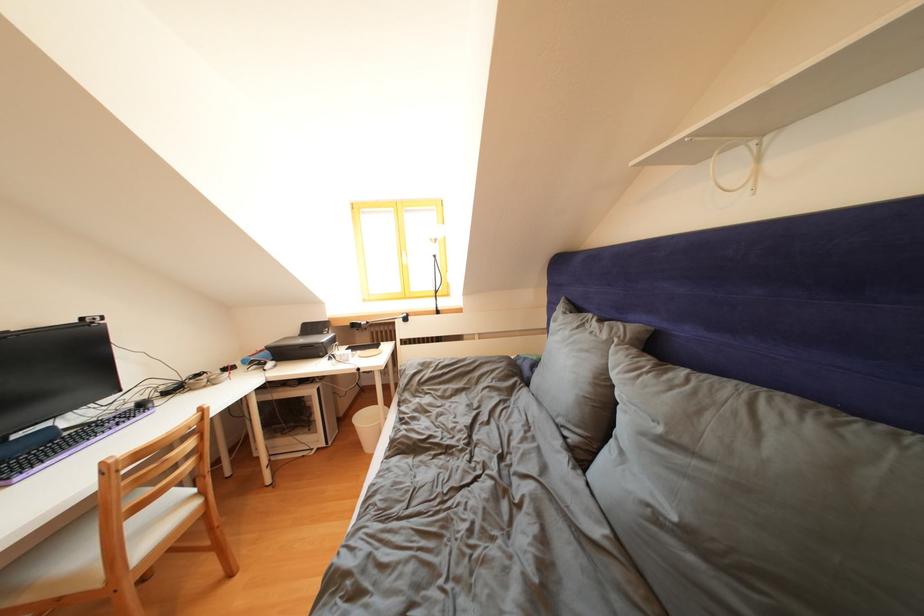
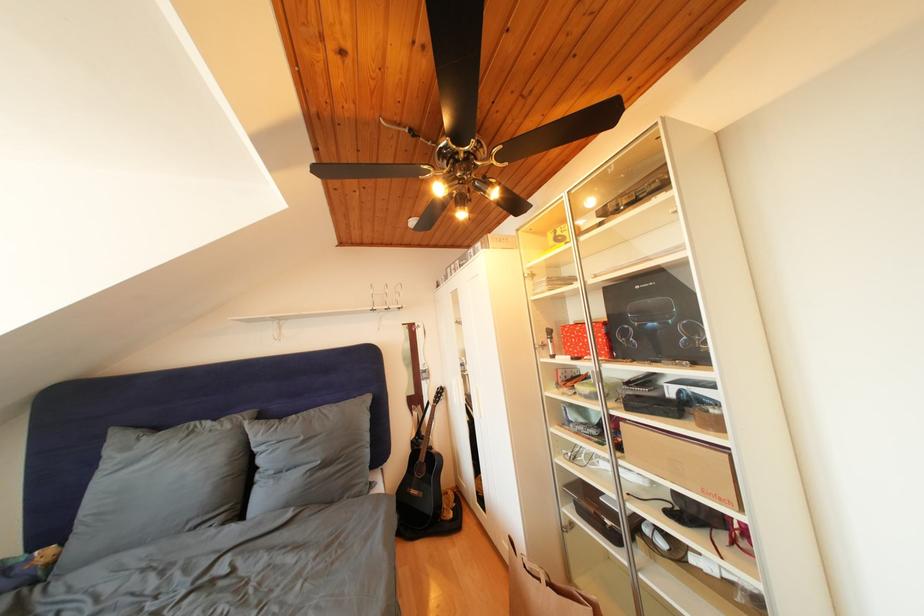
Locate, in the second image, the point that corresponds to (612,341) in the first image.

(236, 432)